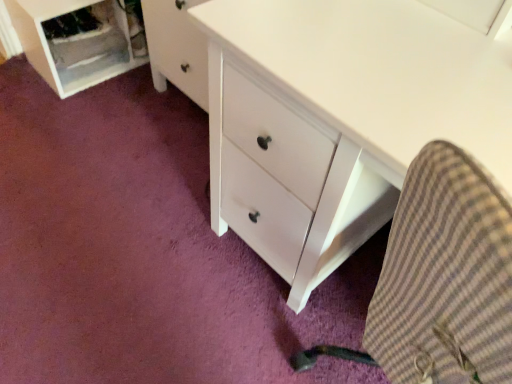
Where is `vacant area on top of white plastic file cabinet at lower left (from a real-world perspective)`? The height and width of the screenshot is (384, 512). vacant area on top of white plastic file cabinet at lower left (from a real-world perspective) is located at coordinates (78, 12).